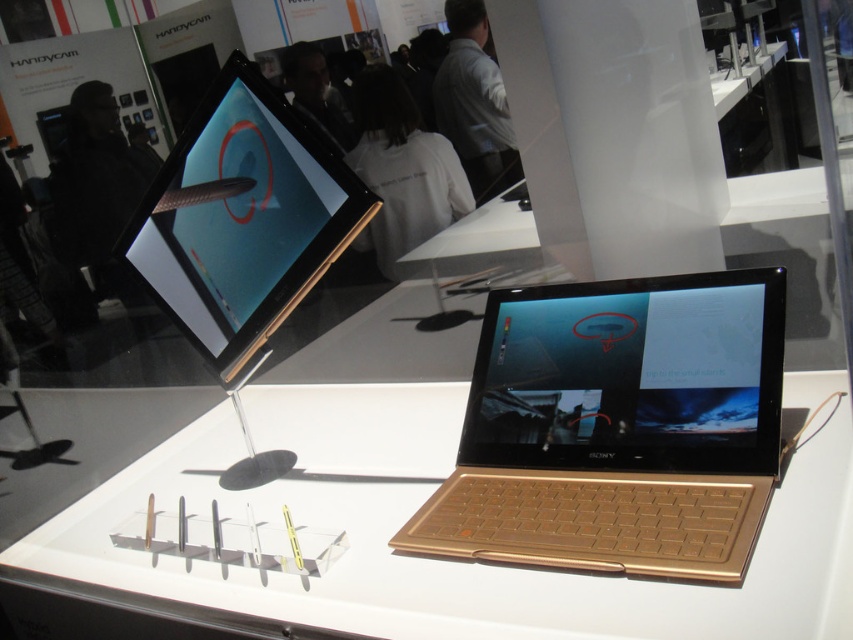
You are setting up a tech exhibition and need to place a promotional banner between the gold metallic table at center and the gold metallic laptop at upper center. Given that the banner is as wide as the table, will it fit without overlapping the laptop?

The gold metallic table at center is wider than the gold metallic laptop at upper center, so placing a banner as wide as the table would cause it to overlap the laptop since the table itself is wider than the laptop.

You are a visitor at the tech exhibition and want to take a photo of the gold metallic laptop at center. However, there is a gold metallic table at center in the way. Can you move the table to get a clear shot of the laptop?

The gold metallic table at center is located below the gold metallic laptop at center, so moving the table would not obstruct the view of the laptop since they are positioned vertically. You can take the photo without moving the table.